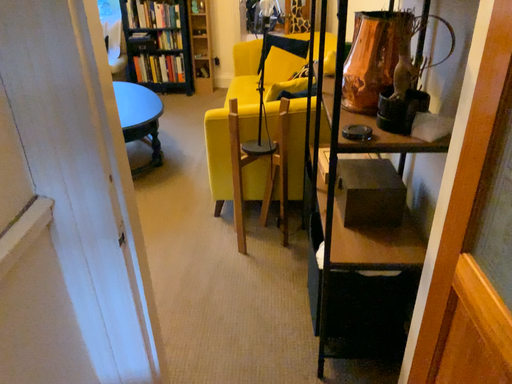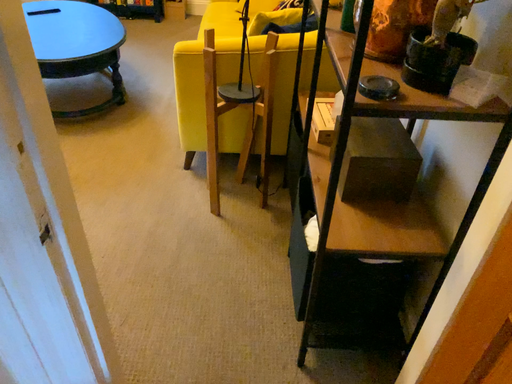
Question: Which way did the camera rotate in the video?

Choices:
 (A) rotated upward
 (B) rotated downward

Answer: (B)